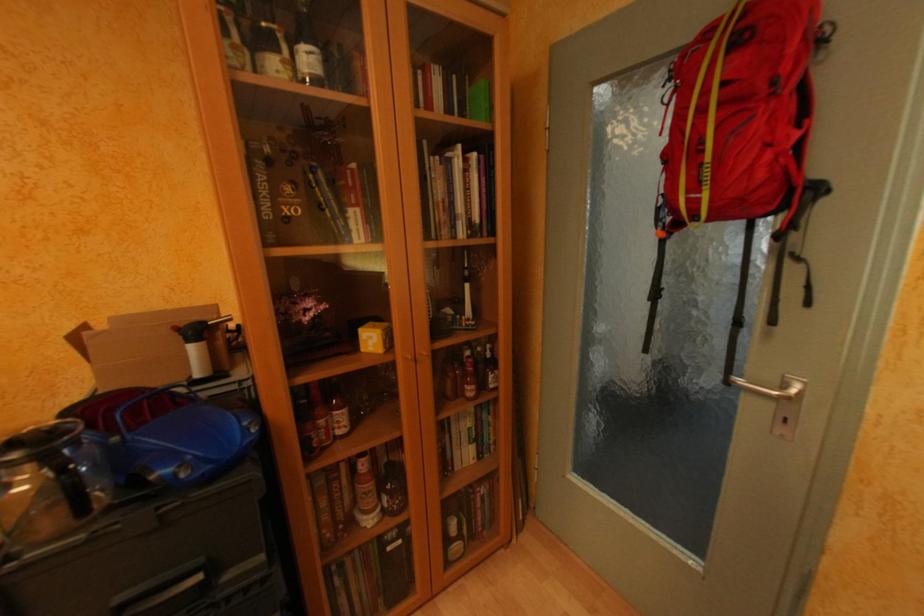
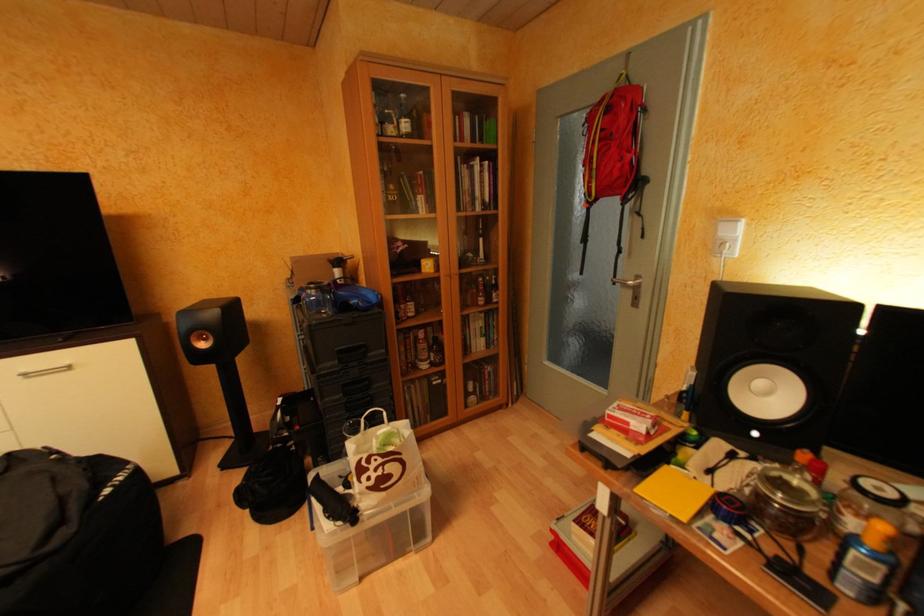
Question: How did the camera likely rotate?

Choices:
 (A) Left
 (B) Right
 (C) Up
 (D) Down

Answer: (A)